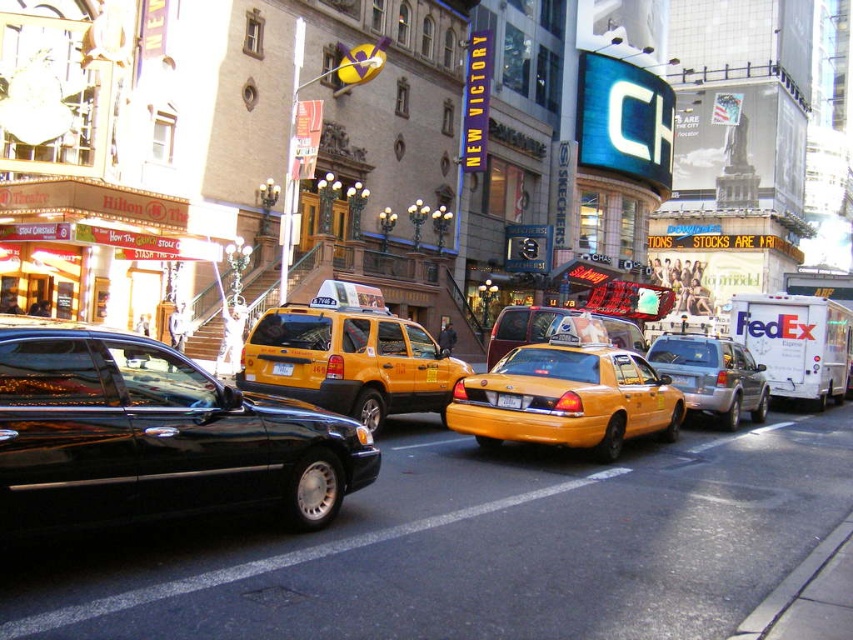
You are a delivery person trying to park your van between the yellow rubber taxi cab at center and the yellow plastic taxi at center. The width of your van is 2 meters. Can you fit your van between them?

The yellow rubber taxi cab at center might be wider than yellow plastic taxi at center, so the distance between them is uncertain. Therefore, it is not possible to determine if the van can fit without knowing the exact spacing.

You are a pedestrian standing at the intersection. You see a shiny black sedan at center and a yellow matte taxi at center. Which vehicle is positioned higher in the image?

The shiny black sedan at center is positioned higher than the yellow matte taxi at center according to the description.

Based on the photo, you are a pedestrian standing on the sidewalk of this busy street. You want to cross the street to reach the FedEx van parked nearby. There are two yellow taxis in the middle of the road. The first is a yellow rubber taxi cab at center and the second is a yellow plastic taxi at center. Given that the safe distance required to cross between two moving vehicles is at least 30 feet, can you safely cross between them?

The yellow rubber taxi cab at center and yellow plastic taxi at center are 27.55 feet apart from each other. Since the required safe distance is 30 feet, the gap between them is insufficient for safe crossing. You should wait for a wider gap or use a crosswalk.